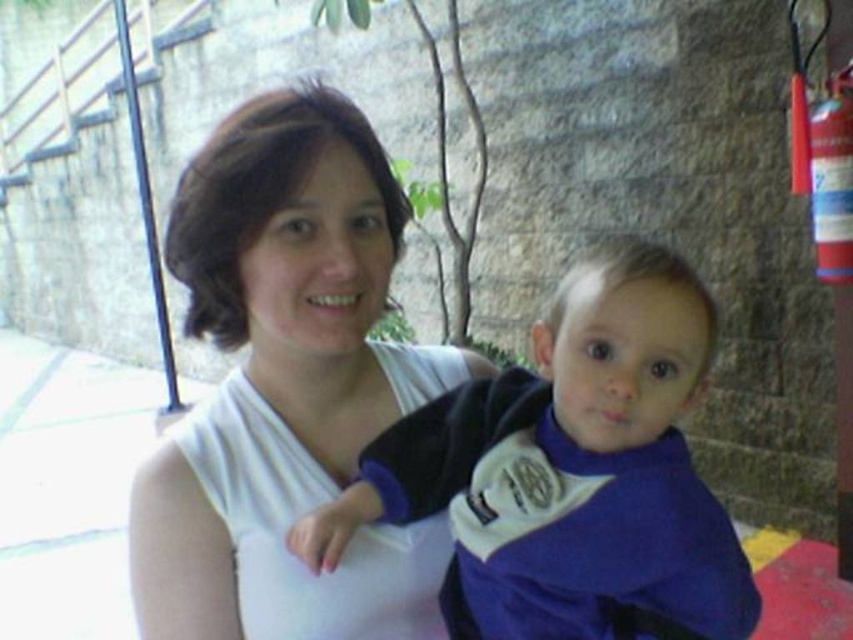
Is point (338, 636) farther from viewer compared to point (480, 608)?

No, (338, 636) is in front of (480, 608).

Is point (196, 204) in front of point (650, 413)?

No, it is not.

The height and width of the screenshot is (640, 853). What are the coordinates of `white matte shirt at center` in the screenshot? It's located at (286, 387).